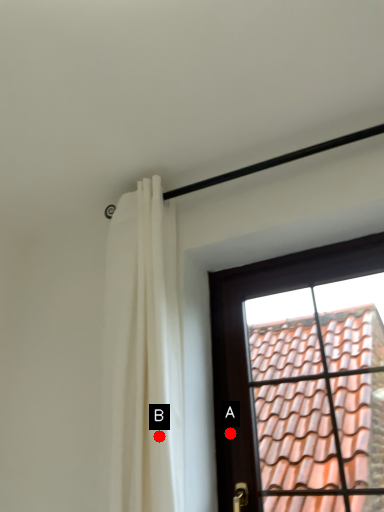
Question: Two points are circled on the image, labeled by A and B beside each circle. Which point is farther to the camera?

Choices:
 (A) A is further
 (B) B is further

Answer: (A)